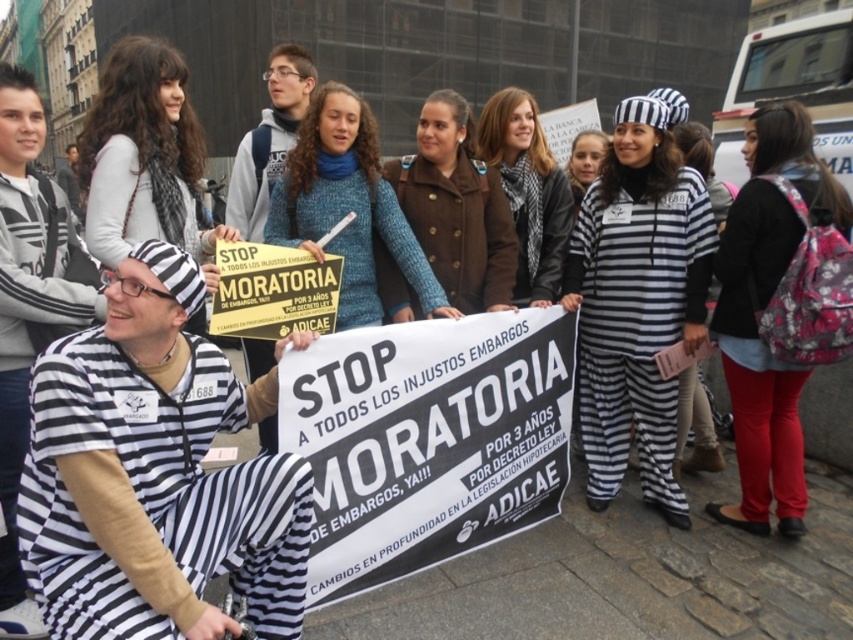
Can you confirm if black and white striped prison uniform at center is positioned to the left of striped prison uniform at center?

Indeed, black and white striped prison uniform at center is positioned on the left side of striped prison uniform at center.

Is black and white striped prison uniform at center below striped prison uniform at center?

Correct, black and white striped prison uniform at center is located below striped prison uniform at center.

What do you see at coordinates (527, 192) in the screenshot? I see `black and white striped prison uniform at center` at bounding box center [527, 192].

The height and width of the screenshot is (640, 853). Identify the location of black and white striped prison uniform at center. (527, 192).

How much distance is there between blue knitted sweater at center and striped prison uniform at center?

blue knitted sweater at center is 1.71 meters away from striped prison uniform at center.

Can you confirm if blue knitted sweater at center is positioned to the left of striped prison uniform at center?

Correct, you'll find blue knitted sweater at center to the left of striped prison uniform at center.

Image resolution: width=853 pixels, height=640 pixels. What do you see at coordinates (347, 205) in the screenshot? I see `blue knitted sweater at center` at bounding box center [347, 205].

This screenshot has height=640, width=853. I want to click on blue knitted sweater at center, so click(347, 205).

Does matte black prison uniform at center appear on the left side of blue knitted sweater at center?

No, matte black prison uniform at center is not to the left of blue knitted sweater at center.

Is matte black prison uniform at center wider than blue knitted sweater at center?

No, matte black prison uniform at center is not wider than blue knitted sweater at center.

Between point (648, 451) and point (369, 264), which one is positioned behind?

The point (648, 451) is more distant.

This screenshot has width=853, height=640. What are the coordinates of `matte black prison uniform at center` in the screenshot? It's located at (637, 301).